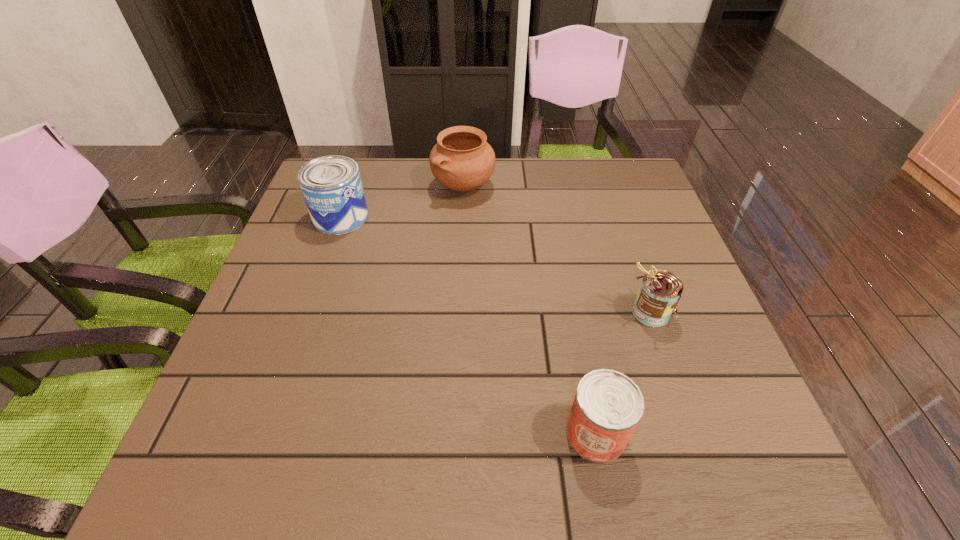
Locate an element on the screen. Image resolution: width=960 pixels, height=540 pixels. pottery is located at coordinates (462, 160).

Where is `the farthest can`? This screenshot has height=540, width=960. the farthest can is located at coordinates pos(331,185).

The width and height of the screenshot is (960, 540). Find the location of `the leftmost object`. the leftmost object is located at coordinates (331, 185).

Locate an element on the screen. the rightmost object is located at coordinates (660, 291).

Locate an element on the screen. This screenshot has width=960, height=540. the third farthest object is located at coordinates (660, 291).

The width and height of the screenshot is (960, 540). I want to click on the nearest can, so click(x=608, y=405).

The height and width of the screenshot is (540, 960). In order to click on the third object from left to right in this screenshot , I will do `click(608, 405)`.

Find the location of a particular element. The image size is (960, 540). vacant point located on the front of the second object from left to right is located at coordinates click(x=458, y=304).

Find the location of a particular element. This screenshot has width=960, height=540. free space located on the front label of the farthest can is located at coordinates (437, 217).

Locate an element on the screen. Image resolution: width=960 pixels, height=540 pixels. free space located 0.170m on the front of the rightmost can is located at coordinates (684, 411).